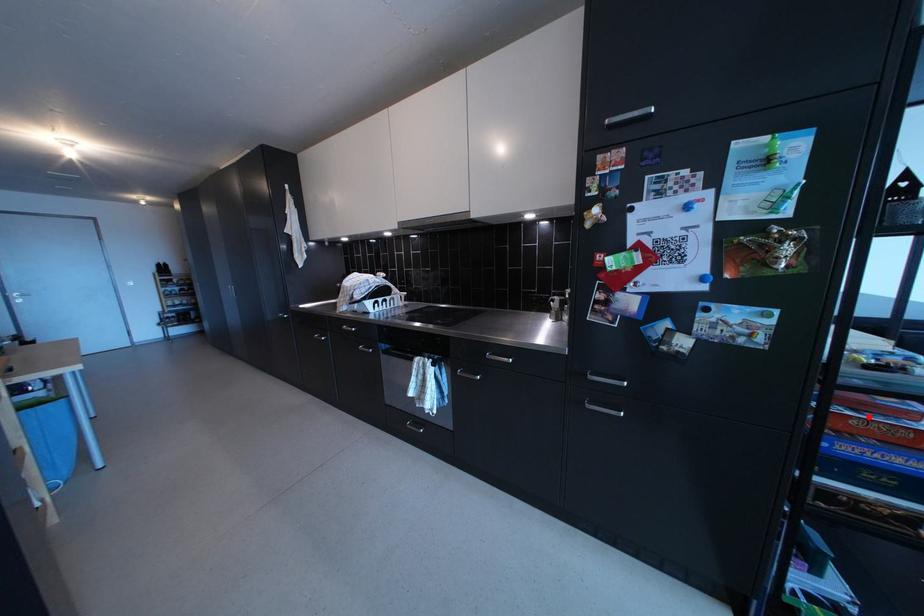
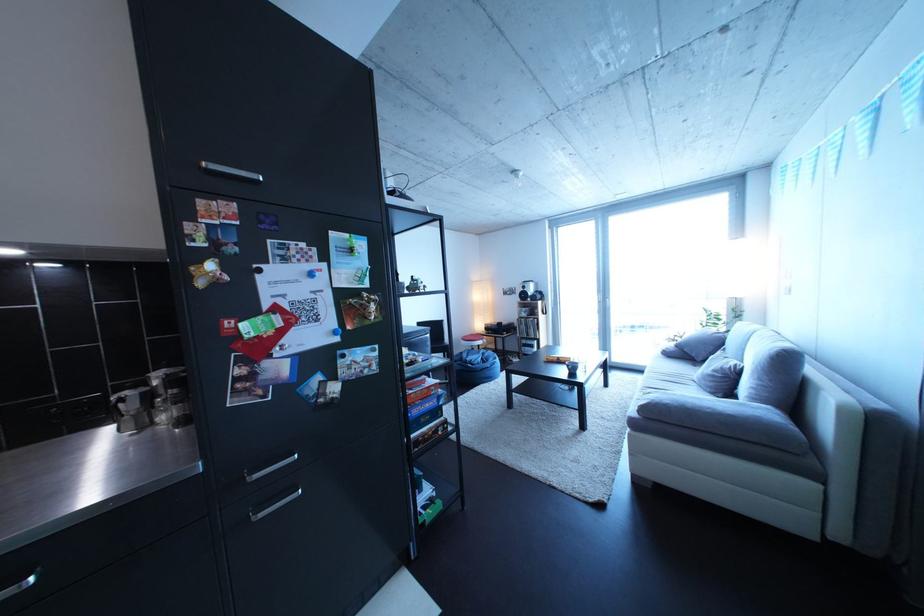
Find the pixel in the second image that matches the highlighted location in the first image.

(424, 395)